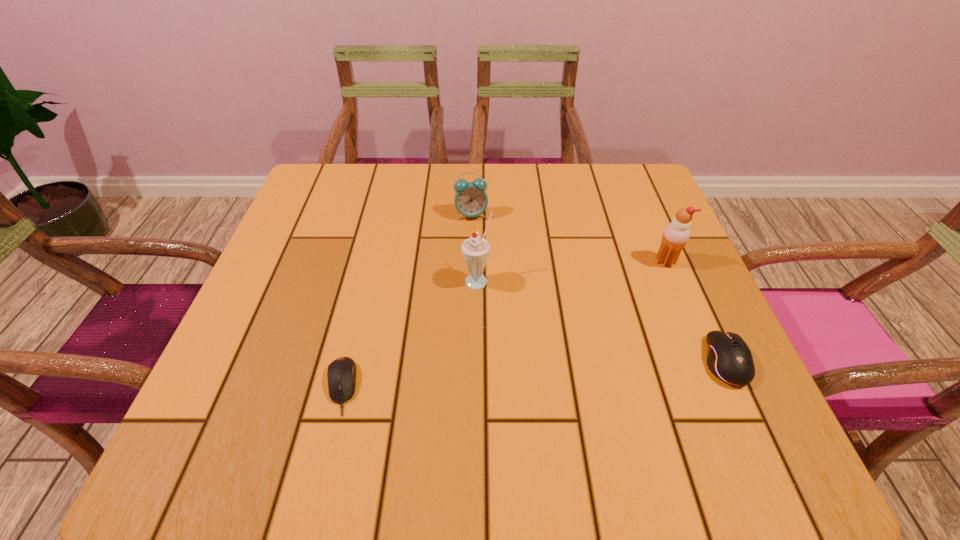
Find the location of a particular element. the shorter computer mouse is located at coordinates (341, 374).

This screenshot has height=540, width=960. I want to click on the leftmost object, so click(341, 374).

Find the location of a particular element. The height and width of the screenshot is (540, 960). the taller computer mouse is located at coordinates (729, 358).

Where is `the fourth tallest object`? This screenshot has width=960, height=540. the fourth tallest object is located at coordinates (729, 358).

You are a GUI agent. You are given a task and a screenshot of the screen. Output one action in this format:
    pyautogui.click(x=<x>, y=<y>)
    Task: Click on the milkshake
    This screenshot has height=540, width=960.
    Given the screenshot: What is the action you would take?
    pyautogui.click(x=475, y=250)

This screenshot has height=540, width=960. I want to click on icecream, so click(676, 234).

What are the coordinates of `alarm clock` in the screenshot? It's located at (470, 198).

What are the coordinates of `the third tallest object` in the screenshot? It's located at (470, 198).

Image resolution: width=960 pixels, height=540 pixels. Find the location of `vacant space located 0.050m on the back of the left computer mouse`. vacant space located 0.050m on the back of the left computer mouse is located at coordinates (353, 336).

The image size is (960, 540). What are the coordinates of `vacant area located on the left of the second shortest object` in the screenshot? It's located at (510, 362).